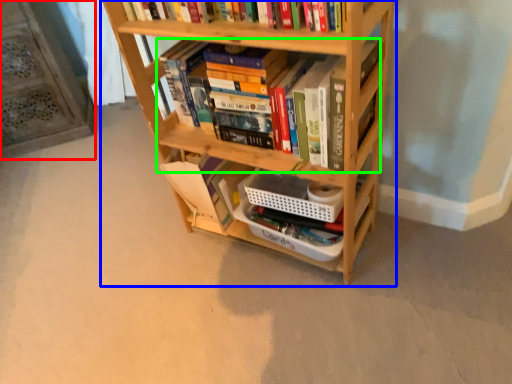
Question: Which object is positioned farthest from shelf (highlighted by a red box)? Select from bookcase (highlighted by a blue box) and book (highlighted by a green box).

Choices:
 (A) bookcase
 (B) book

Answer: (B)